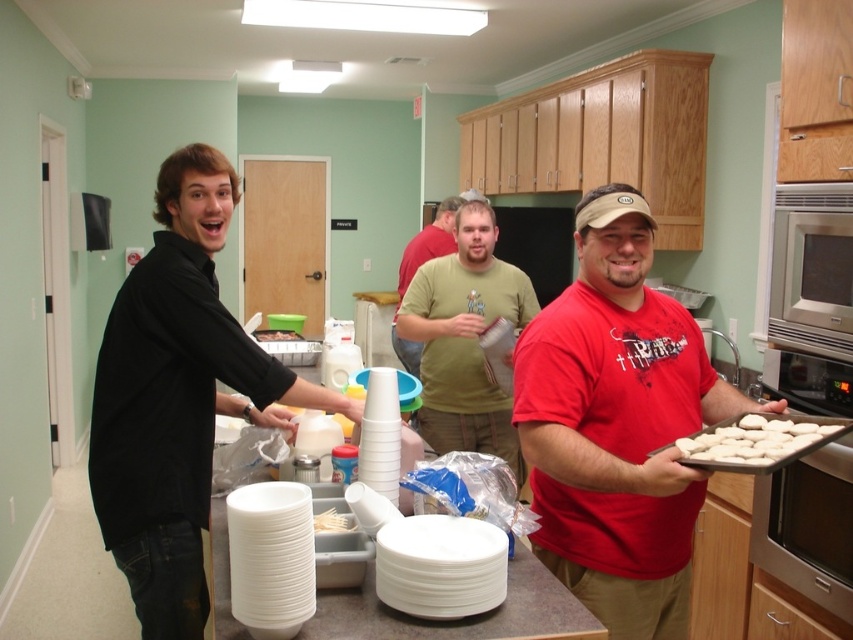
Based on the scene description, where is the red matte shirt at center located in terms of its 2D coordinates?

The red matte shirt at center is located at the 2D coordinates of point (618, 426).

You are a photographer trying to capture a candid shot of the black matte shirt at left and the white plastic forks at center. If your camera can only focus on objects within a 1.2 meter width, will both fit in the frame?

The black matte shirt at left might be wider than white plastic forks at center, so there is a possibility that the total width of both objects exceeds the camera frame limit of 1.2 meters. It depends on their exact widths.

Looking at this image, you are standing in the kitchen and see the red matte shirt at center and the white plastic forks at center. Which object is positioned to the left?

The white plastic forks at center are to the left of the red matte shirt at center.